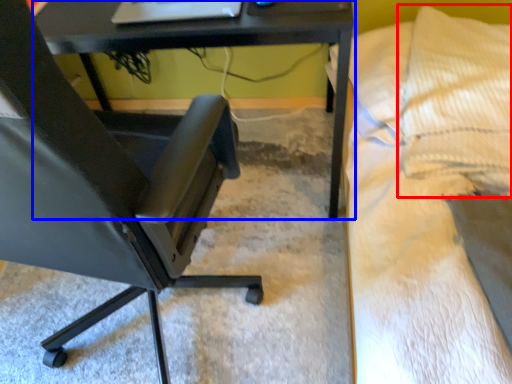
Question: Which object is further to the camera taking this photo, pillow (highlighted by a red box) or table (highlighted by a blue box)?

Choices:
 (A) pillow
 (B) table

Answer: (A)